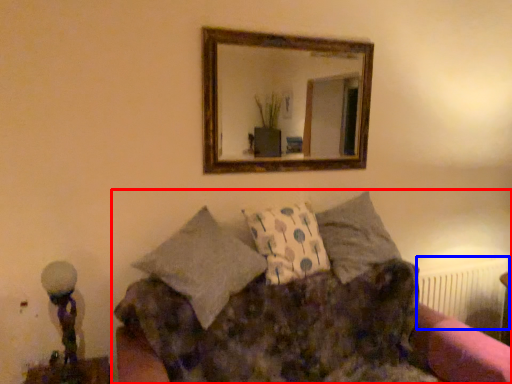
Question: Which object is further to the camera taking this photo, studio couch (highlighted by a red box) or radiator (highlighted by a blue box)?

Choices:
 (A) studio couch
 (B) radiator

Answer: (B)